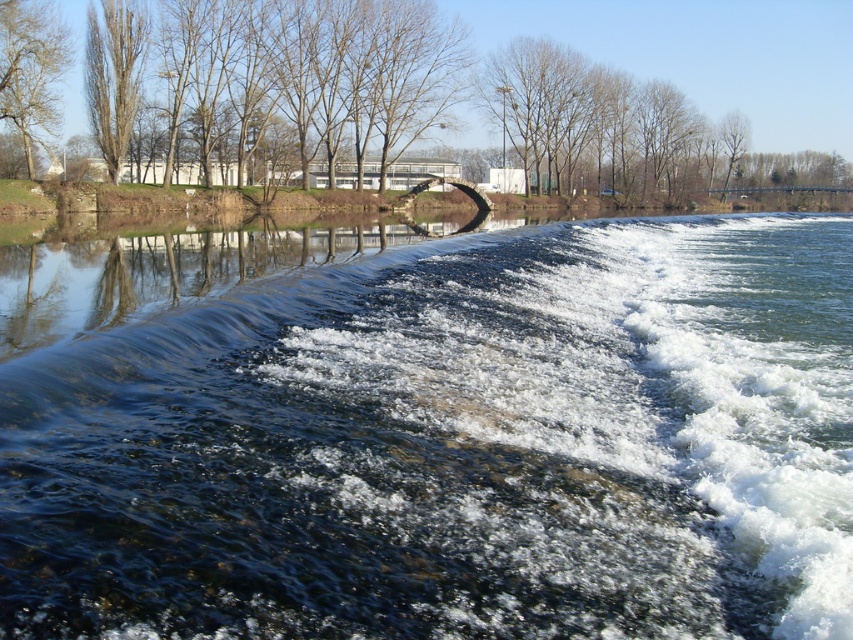
You are a photographer planning to capture the waterfall scene. You have a camera with a wide angle lens that can capture large objects. Which object between the clear water at center and the smooth bark tree at upper left would be better suited for your shot?

The clear water at center is larger in size than the smooth bark tree at upper left, so it would be better suited for your wide angle lens shot as it can accommodate larger objects.

You are a bird flying over the river and want to land on a tree. Which tree, the brown leafless tree at upper left or the smooth bark tree at upper left, would you choose if you want to land on the taller one?

The brown leafless tree at upper left is taller than the smooth bark tree at upper left, so you should choose the brown leafless tree at upper left to land on.

You are an artist setting up your easel to paint the river scene. You want to ensure the brown leafless tree at upper left is visible behind the clear water at center. Is this possible given their positions?

The clear water at center is in front of the brown leafless tree at upper left, so the tree will not be visible behind the water since the water is blocking it.